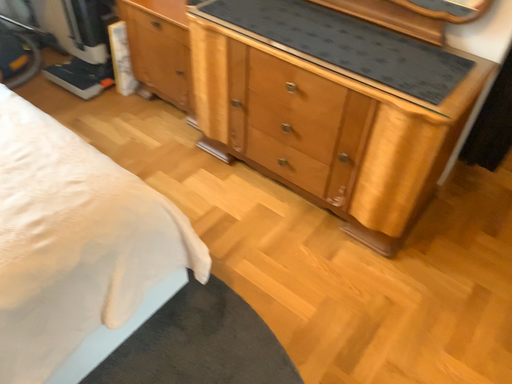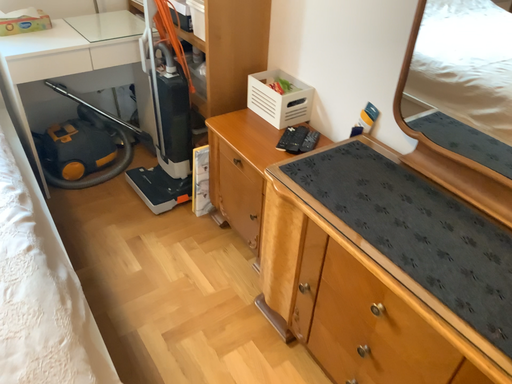
Question: How did the camera likely rotate when shooting the video?

Choices:
 (A) rotated left
 (B) rotated right

Answer: (A)